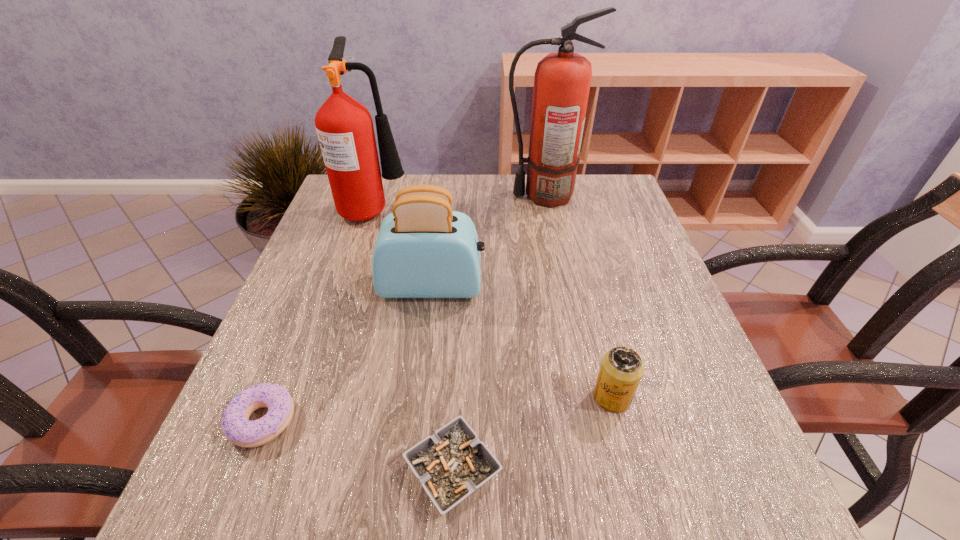
This screenshot has width=960, height=540. In order to click on free space located on the nozzle of the right fire extinguisher in this screenshot , I will do `click(410, 195)`.

The image size is (960, 540). I want to click on vacant space positioned 0.400m at the nozzle of the shorter fire extinguisher, so click(561, 208).

This screenshot has height=540, width=960. I want to click on free space located 0.070m on the side of the fourth shortest object with the lever, so click(x=517, y=286).

Image resolution: width=960 pixels, height=540 pixels. What are the coordinates of `blank space located 0.270m on the back of the fourth tallest object` in the screenshot? It's located at (582, 277).

Where is `vacant space located on the back of the fifth tallest object`? The height and width of the screenshot is (540, 960). vacant space located on the back of the fifth tallest object is located at coordinates (328, 258).

The image size is (960, 540). I want to click on free location located on the left of the ashtray, so click(248, 471).

The width and height of the screenshot is (960, 540). I want to click on object at the near edge, so click(453, 463).

Where is `fire extinguisher at the left edge`? This screenshot has width=960, height=540. fire extinguisher at the left edge is located at coordinates (344, 126).

Locate an element on the screen. doughnut that is at the left edge is located at coordinates (235, 423).

I want to click on fire extinguisher that is at the right edge, so click(x=562, y=80).